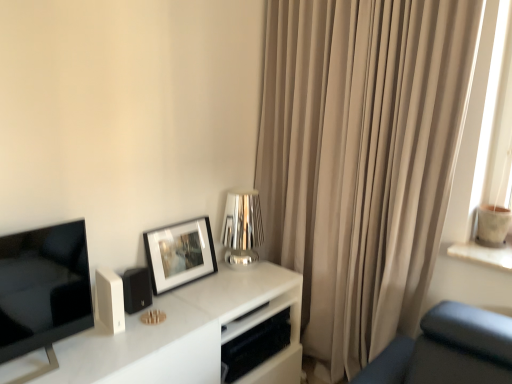
Identify the location of matte black speaker at lower left. The width and height of the screenshot is (512, 384). (136, 289).

The image size is (512, 384). What do you see at coordinates (42, 288) in the screenshot? I see `black glossy television at left` at bounding box center [42, 288].

Identify the location of white marble tv stand at center. The height and width of the screenshot is (384, 512). tap(189, 334).

At what (x,y) coordinates should I click in order to perform the action: click on beige fabric curtain at right. Please return your answer as a coordinate pair (x, y). This screenshot has width=512, height=384. Looking at the image, I should click on (360, 159).

At what (x,y) coordinates should I click in order to perform the action: click on speaker that appears on the right of white plastic speaker at lower left. Please return your answer as a coordinate pair (x, y). The image size is (512, 384). Looking at the image, I should click on (136, 289).

Is white plastic speaker at lower left oriented away from matte black speaker at lower left?

No, white plastic speaker at lower left is not facing away from matte black speaker at lower left.

Which object is further away from the camera, white plastic speaker at lower left or matte black speaker at lower left?

matte black speaker at lower left is behind.

From the image's perspective, is white plastic speaker at lower left above or below matte black speaker at lower left?

white plastic speaker at lower left is situated lower than matte black speaker at lower left in the image.

From the picture: Between matte black speaker at lower left and beige fabric curtain at right, which one is positioned behind?

matte black speaker at lower left is further away from the camera.

Can beige fabric curtain at right be found inside matte black speaker at lower left?

No.

Could you tell me if matte black speaker at lower left is turned towards beige fabric curtain at right?

No, matte black speaker at lower left is not oriented towards beige fabric curtain at right.

Based on the photo, from a real-world perspective, who is located higher, matte black speaker at lower left or beige fabric curtain at right?

From a 3D spatial view, beige fabric curtain at right is above.

Which object is more forward, matte black picture frame at center left or matte black speaker at lower left?

matte black speaker at lower left is more forward.

Would you say matte black picture frame at center left is inside or outside matte black speaker at lower left?

matte black picture frame at center left is not inside matte black speaker at lower left, it's outside.

Find the location of a particular element. speaker located in front of the matte black picture frame at center left is located at coordinates (136, 289).

Is matte black picture frame at center left facing away from matte black speaker at lower left?

Answer: matte black picture frame at center left does not have its back to matte black speaker at lower left.

How far apart are matte black picture frame at center left and black glossy television at left?

They are 21.28 inches apart.

Does matte black picture frame at center left have a lesser height compared to black glossy television at left?

Correct, matte black picture frame at center left is not as tall as black glossy television at left.

From the picture: Is matte black picture frame at center left oriented towards black glossy television at left?

No, matte black picture frame at center left is not oriented towards black glossy television at left.

Based on their sizes in the image, would you say matte black picture frame at center left is bigger or smaller than black glossy television at left?

Clearly, matte black picture frame at center left is smaller in size than black glossy television at left.

Looking at this image, from the image's perspective, between matte black picture frame at center left and shiny metallic table lamp at center, who is located below?

matte black picture frame at center left appears lower in the image.

What's the angular difference between matte black picture frame at center left and shiny metallic table lamp at center's facing directions?

matte black picture frame at center left and shiny metallic table lamp at center are facing 0.000274 degrees away from each other.

Is point (168, 256) positioned after point (226, 206)?

That is False.

Consider the image. Do you think matte black picture frame at center left is within shiny metallic table lamp at center, or outside of it?

matte black picture frame at center left exists outside the volume of shiny metallic table lamp at center.

Are shiny metallic table lamp at center and beige fabric curtain at right beside each other?

No, shiny metallic table lamp at center is not making contact with beige fabric curtain at right.

From the image's perspective, between shiny metallic table lamp at center and beige fabric curtain at right, who is located below?

shiny metallic table lamp at center appears lower in the image.

Which object is positioned more to the left, shiny metallic table lamp at center or beige fabric curtain at right?

shiny metallic table lamp at center.

Considering the sizes of objects shiny metallic table lamp at center and beige fabric curtain at right in the image provided, who is shorter, shiny metallic table lamp at center or beige fabric curtain at right?

shiny metallic table lamp at center.

Locate an element on the screen. Image resolution: width=512 pixels, height=384 pixels. table lamp that is on the right side of white plastic speaker at lower left is located at coordinates (242, 227).

Which object is closer to the camera, shiny metallic table lamp at center or white plastic speaker at lower left?

Positioned in front is white plastic speaker at lower left.

Can you tell me how much shiny metallic table lamp at center and white plastic speaker at lower left differ in facing direction?

The angular difference between shiny metallic table lamp at center and white plastic speaker at lower left is 7.66 degrees.

Who is bigger, shiny metallic table lamp at center or white plastic speaker at lower left?

Bigger between the two is shiny metallic table lamp at center.

The height and width of the screenshot is (384, 512). I want to click on appliance above the matte black speaker at lower left (from a real-world perspective), so click(x=110, y=300).

Identify the location of curtain on the right of the matte black speaker at lower left. (360, 159).

Based on their spatial positions, is matte black speaker at lower left or matte black picture frame at center left further from white marble tv stand at center?

Among the two, matte black speaker at lower left is located further to white marble tv stand at center.

Which object lies nearer to the anchor point beige fabric curtain at right, matte black speaker at lower left or white marble tv stand at center?

white marble tv stand at center.

Considering their positions, is matte black speaker at lower left positioned further to black glossy television at left than shiny metallic table lamp at center?

Based on the image, shiny metallic table lamp at center appears to be further to black glossy television at left.

From the image, which object appears to be nearer to matte black speaker at lower left, white plastic speaker at lower left or white marble tv stand at center?

Among the two, white plastic speaker at lower left is located nearer to matte black speaker at lower left.

Considering their positions, is white plastic speaker at lower left positioned closer to shiny metallic table lamp at center than white marble tv stand at center?

Among the two, white marble tv stand at center is located nearer to shiny metallic table lamp at center.

When comparing their distances from matte black speaker at lower left, does white plastic speaker at lower left or matte black picture frame at center left seem further?

matte black picture frame at center left is further to matte black speaker at lower left.

Based on the photo, from the image, which object appears to be farther from matte black picture frame at center left, black glossy television at left or matte black speaker at lower left?

black glossy television at left.

From the image, which object appears to be farther from shiny metallic table lamp at center, black glossy television at left or matte black picture frame at center left?

Among the two, black glossy television at left is located further to shiny metallic table lamp at center.

I want to click on appliance positioned between white marble tv stand at center and shiny metallic table lamp at center from near to far, so click(x=110, y=300).

The image size is (512, 384). I want to click on picture frame positioned between white marble tv stand at center and shiny metallic table lamp at center from near to far, so click(180, 254).

Where is `speaker located between white marble tv stand at center and matte black picture frame at center left in the depth direction`? Image resolution: width=512 pixels, height=384 pixels. speaker located between white marble tv stand at center and matte black picture frame at center left in the depth direction is located at coordinates (136, 289).

Identify the location of curtain between white marble tv stand at center and shiny metallic table lamp at center along the z-axis. Image resolution: width=512 pixels, height=384 pixels. (360, 159).